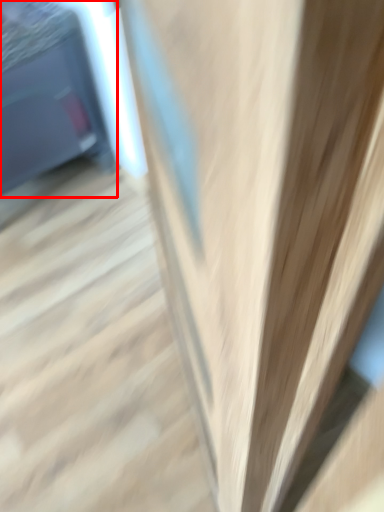
Question: Where is furniture (annotated by the red box) located in relation to stairs in the image?

Choices:
 (A) right
 (B) left

Answer: (B)